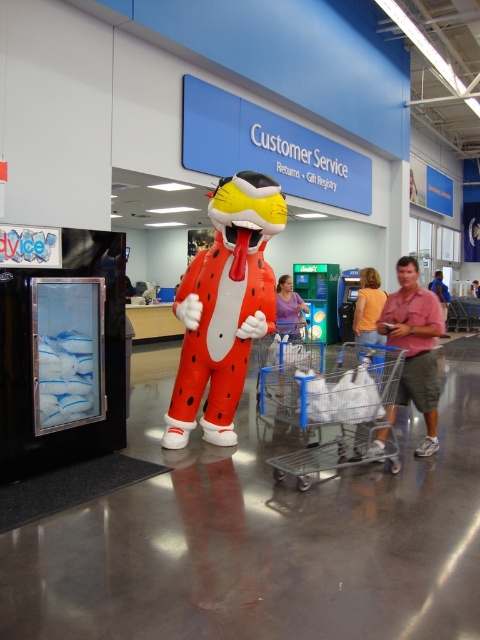
Question: Is inflatable orange at center to the right of purple cotton shirt at center from the viewer's perspective?

Choices:
 (A) yes
 (B) no

Answer: (B)

Question: Which object is farther from the camera taking this photo?

Choices:
 (A) pink fabric shirt at center
 (B) pink cotton shirt at center

Answer: (A)

Question: Which point appears farthest from the camera in this image?

Choices:
 (A) (360, 296)
 (B) (350, 428)

Answer: (A)

Question: Which of the following is the closest to the observer?

Choices:
 (A) (282, 310)
 (B) (474, 285)

Answer: (A)

Question: Is orange cotton shirt at center above pink fabric shirt at center?

Choices:
 (A) yes
 (B) no

Answer: (B)

Question: Does clear plastic shopping cart at center appear on the right side of purple cotton shirt at center?

Choices:
 (A) no
 (B) yes

Answer: (B)